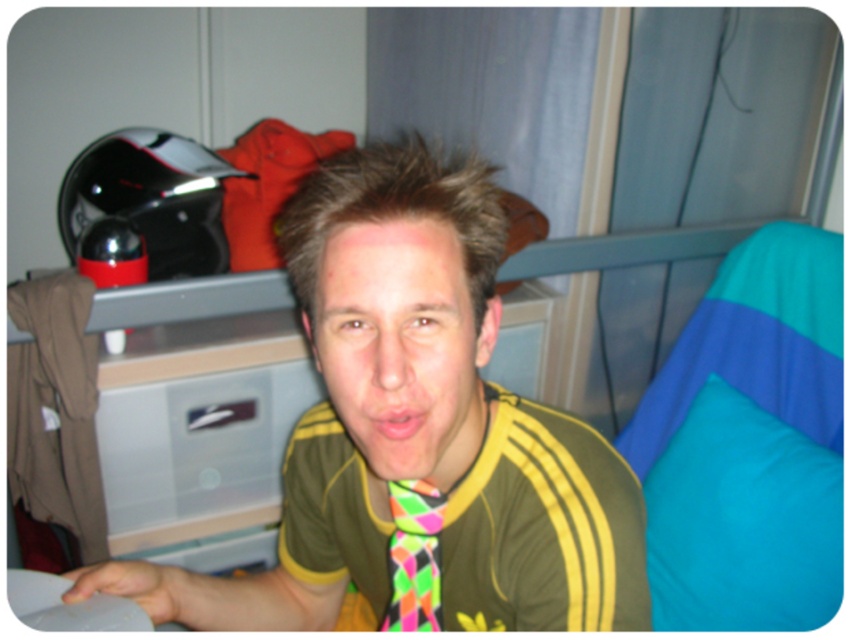
You are an interior designer organizing a closet. You see the neon multicolored fabric tie at center and the pink neon tie at center hanging in the closet. Which tie is located below the other?

The neon multicolored fabric tie at center is positioned under the pink neon tie at center, so it is located below the pink neon tie at center.

You are a tailor measuring two ties in the image. The neon tie at center and the neon multicolored fabric tie at center. Which one is wider?

The neon tie at center is wider than the neon multicolored fabric tie at center according to the description.